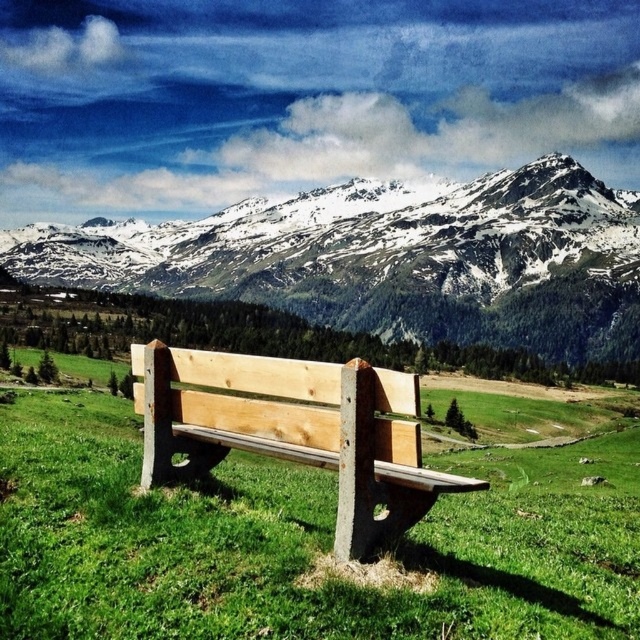
From the picture: Who is more forward, [147,246] or [333,381]?

Point [333,381] is more forward.

Describe the element at coordinates (390, 259) in the screenshot. This screenshot has width=640, height=640. I see `snowy granite mountain range at upper center` at that location.

This screenshot has height=640, width=640. Find the location of `snowy granite mountain range at upper center`. snowy granite mountain range at upper center is located at coordinates (390, 259).

Is natural green grass at center positioned at the back of snowy granite mountain range at upper center?

No, natural green grass at center is closer to the viewer.

What do you see at coordinates (300, 541) in the screenshot?
I see `natural green grass at center` at bounding box center [300, 541].

Where is `natural green grass at center`? The image size is (640, 640). natural green grass at center is located at coordinates (300, 541).

Does point (115, 568) come behind point (260, 416)?

No, it is in front of (260, 416).

Does natural green grass at center appear under natural wood bench at center?

Yes, natural green grass at center is below natural wood bench at center.

Which is in front, point (268, 611) or point (195, 358)?

Point (268, 611)

Where is `natural green grass at center`? natural green grass at center is located at coordinates (300, 541).